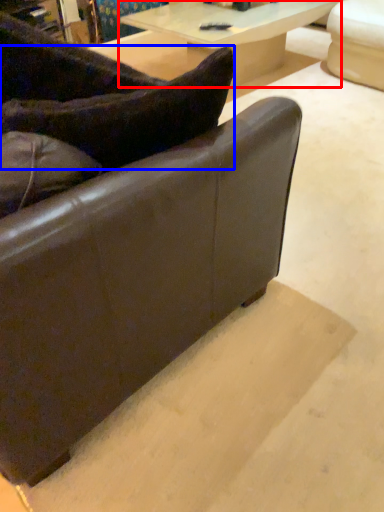
Question: Which of the following is the closest to the observer, table (highlighted by a red box) or pillow (highlighted by a blue box)?

Choices:
 (A) table
 (B) pillow

Answer: (B)